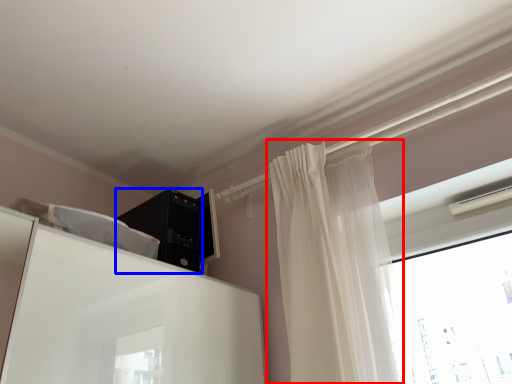
Question: Among these objects, which one is farthest to the camera, curtain (highlighted by a red box) or appliance (highlighted by a blue box)?

Choices:
 (A) curtain
 (B) appliance

Answer: (B)